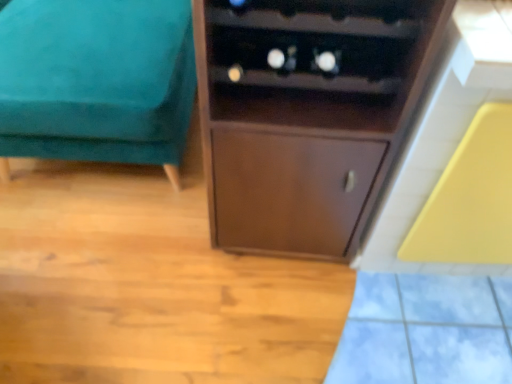
This screenshot has width=512, height=384. Identify the location of free point in front of brown wood cupboard at center. (281, 319).